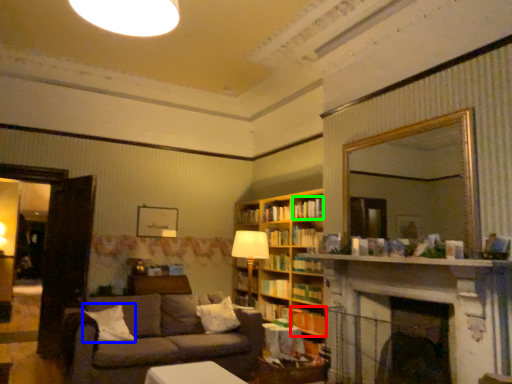
Question: Which object is the closest to the book (highlighted by a red box)? Choose among these: pillow (highlighted by a blue box) or book (highlighted by a green box).

Choices:
 (A) pillow
 (B) book

Answer: (B)